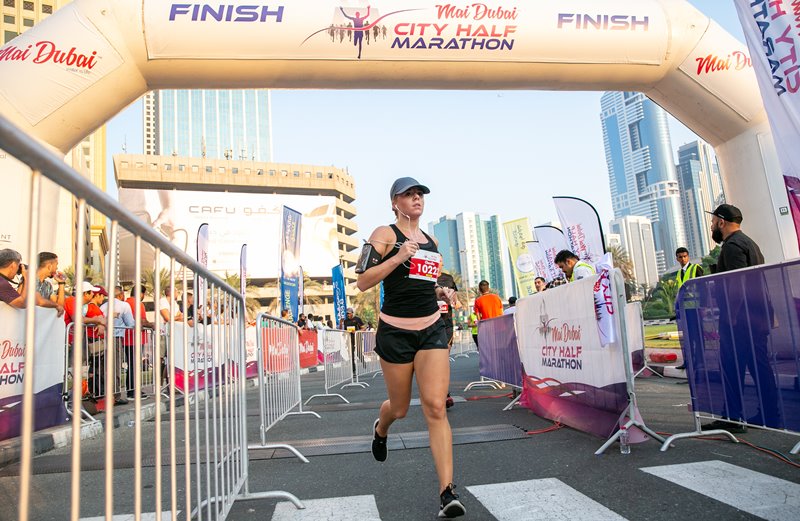
Locate an element on the screen. phone holder is located at coordinates click(x=360, y=253).